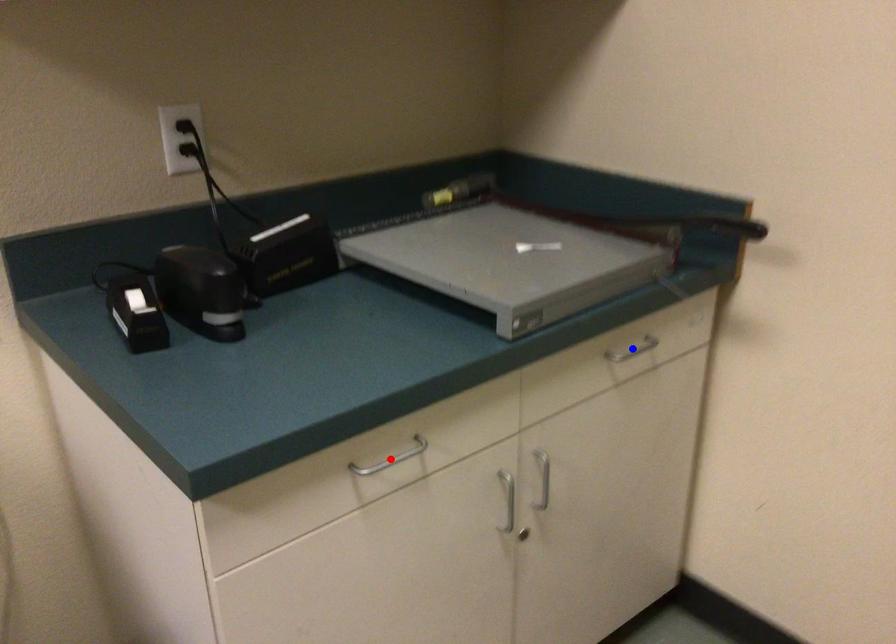
Question: Two points are marked on the image. Which point is closer to the camera?

Choices:
 (A) Blue point is closer.
 (B) Red point is closer.

Answer: (B)